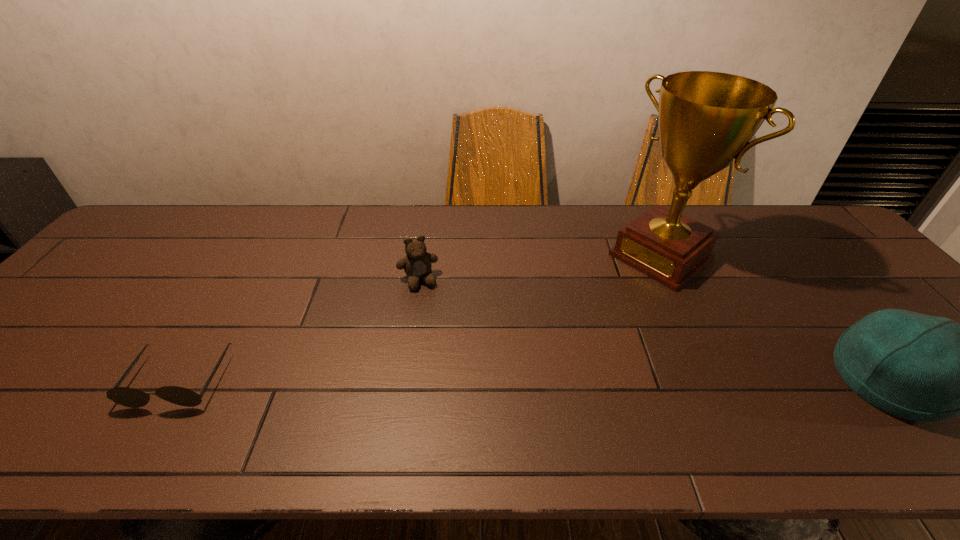
At what (x,y) coordinates should I click in order to perform the action: click on unoccupied area between the leftmost object and the second object from right to left. Please return your answer as a coordinate pair (x, y). Image resolution: width=960 pixels, height=540 pixels. Looking at the image, I should click on (420, 318).

Identify the location of object that is the third nearest to the third shortest object. (129, 397).

Point out which object is positioned as the second nearest to the sunglasses. Please provide its 2D coordinates. Your answer should be formatted as a tuple, i.e. [(x, y)], where the tuple contains the x and y coordinates of a point satisfying the conditions above.

[(706, 119)]